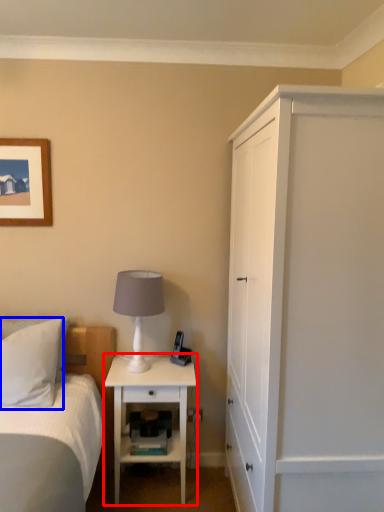
Question: Among these objects, which one is nearest to the camera, nightstand (highlighted by a red box) or pillow (highlighted by a blue box)?

Choices:
 (A) nightstand
 (B) pillow

Answer: (B)